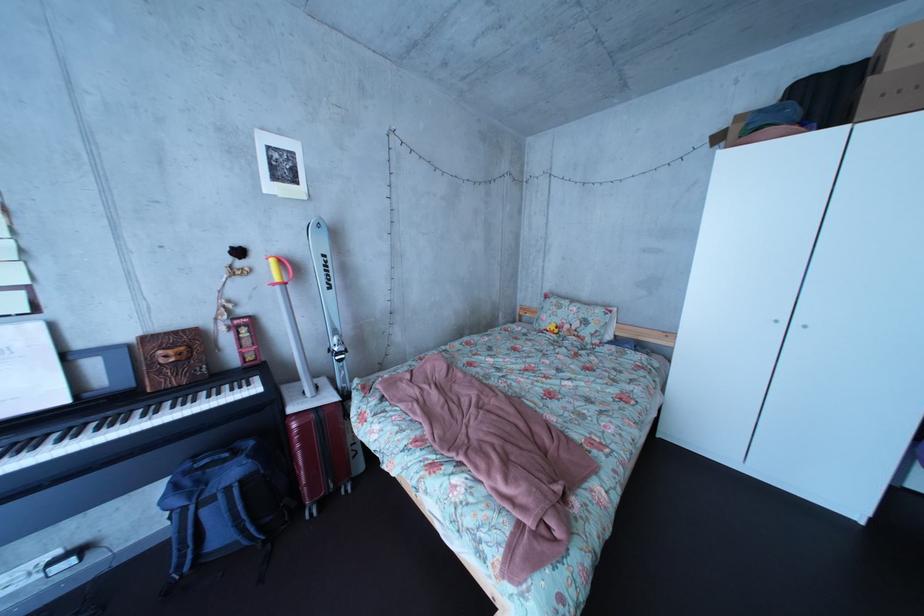
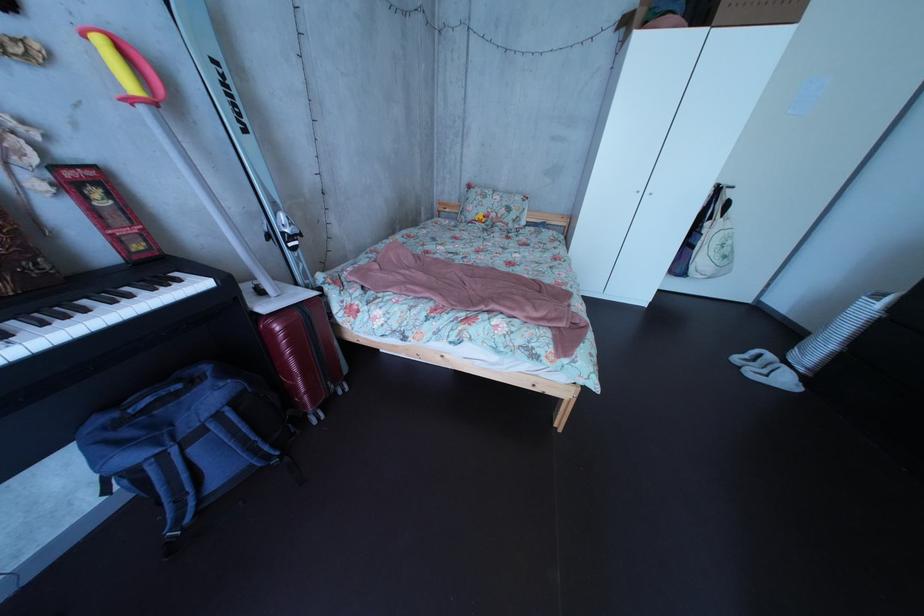
Where in the second image is the point corresponding to [327,424] from the first image?

(311, 322)